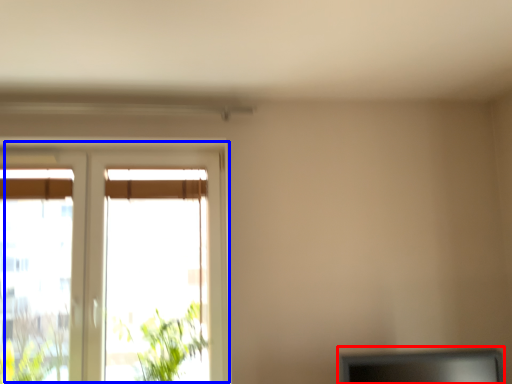
Question: Among these objects, which one is nearest to the camera, computer monitor (highlighted by a red box) or window (highlighted by a blue box)?

Choices:
 (A) computer monitor
 (B) window

Answer: (A)